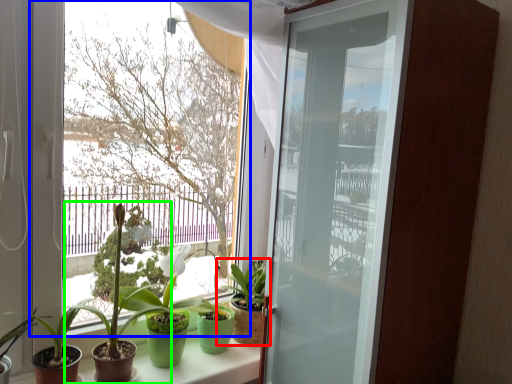
Question: Which is farther away from houseplant (highlighted by a red box)? window (highlighted by a blue box) or houseplant (highlighted by a green box)?

Choices:
 (A) window
 (B) houseplant

Answer: (A)